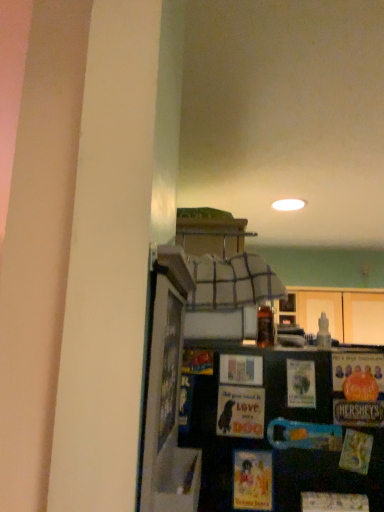
Question: From a real-world perspective, is matte paper postcard at center, marked as the 1th postcard in a right-to-left arrangement, positioned over translucent glass bottle at upper center based on gravity?

Choices:
 (A) yes
 (B) no

Answer: (B)

Question: Does matte paper postcard at center, marked as the 1th postcard in a right-to-left arrangement, have a lesser height compared to translucent glass bottle at upper center?

Choices:
 (A) no
 (B) yes

Answer: (A)

Question: Considering the relative sizes of matte paper postcard at center, marked as the 1th postcard in a right-to-left arrangement, and translucent glass bottle at upper center in the image provided, is matte paper postcard at center, marked as the 1th postcard in a right-to-left arrangement, thinner than translucent glass bottle at upper center?

Choices:
 (A) no
 (B) yes

Answer: (B)

Question: Does matte paper postcard at center, marked as the 1th postcard in a right-to-left arrangement, contain translucent glass bottle at upper center?

Choices:
 (A) yes
 (B) no

Answer: (B)

Question: Is matte paper postcard at center, marked as the 1th postcard in a right-to-left arrangement, to the left of translucent glass bottle at upper center from the viewer's perspective?

Choices:
 (A) no
 (B) yes

Answer: (B)

Question: Is matte paper postcard at center, the 2th postcard in the left-to-right sequence, far away from translucent glass bottle at upper center?

Choices:
 (A) yes
 (B) no

Answer: (B)

Question: Can you confirm if matte paper postcard at center, the 2th postcard in the left-to-right sequence, is wider than matte paper postcard at center, which is the 2th postcard in right-to-left order?

Choices:
 (A) no
 (B) yes

Answer: (B)

Question: Can you see matte paper postcard at center, marked as the 1th postcard in a right-to-left arrangement, touching matte paper postcard at center, arranged as the 1th postcard when viewed from the left?

Choices:
 (A) yes
 (B) no

Answer: (A)

Question: Is there a large distance between matte paper postcard at center, marked as the 1th postcard in a right-to-left arrangement, and matte paper postcard at center, which is the 2th postcard in right-to-left order?

Choices:
 (A) yes
 (B) no

Answer: (B)

Question: Considering the relative positions of matte paper postcard at center, marked as the 1th postcard in a right-to-left arrangement, and matte paper postcard at center, arranged as the 1th postcard when viewed from the left, in the image provided, is matte paper postcard at center, marked as the 1th postcard in a right-to-left arrangement, in front of matte paper postcard at center, arranged as the 1th postcard when viewed from the left,?

Choices:
 (A) yes
 (B) no

Answer: (B)

Question: Does matte paper postcard at center, the 2th postcard in the left-to-right sequence, have a smaller size compared to matte paper postcard at center, arranged as the 1th postcard when viewed from the left?

Choices:
 (A) no
 (B) yes

Answer: (B)

Question: Considering the relative positions of matte paper postcard at center, the 2th postcard in the left-to-right sequence, and matte paper postcard at center, which is the 2th postcard in right-to-left order, in the image provided, is matte paper postcard at center, the 2th postcard in the left-to-right sequence, to the left of matte paper postcard at center, which is the 2th postcard in right-to-left order, from the viewer's perspective?

Choices:
 (A) no
 (B) yes

Answer: (A)

Question: Would you consider matte paper postcard at center, arranged as the 1th postcard when viewed from the left, to be distant from translucent glass bottle at upper center?

Choices:
 (A) no
 (B) yes

Answer: (A)